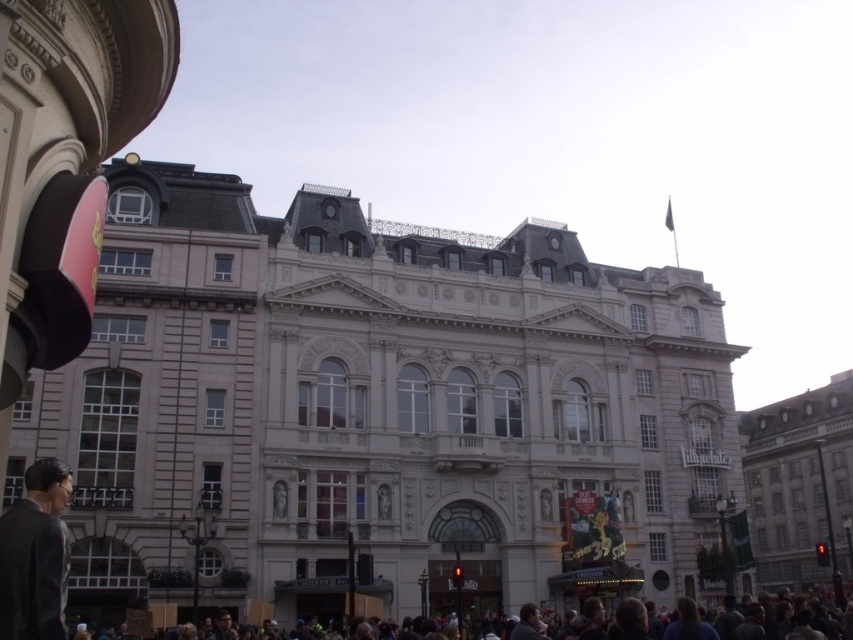
Based on the photo, can you confirm if dark gray clothing at lower center is bigger than dark gray suit at lower left?

Correct, dark gray clothing at lower center is larger in size than dark gray suit at lower left.

Which is behind, point (431, 627) or point (59, 570)?

The point (431, 627) is more distant.

Is point (793, 620) in front of point (15, 516)?

No, (793, 620) is behind (15, 516).

At what (x,y) coordinates should I click in order to perform the action: click on dark gray clothing at lower center. Please return your answer as a coordinate pair (x, y). Looking at the image, I should click on (701, 620).

Which of these two, dark gray clothing at lower center or matte black glasses at lower center, stands taller?

Standing taller between the two is dark gray clothing at lower center.

Who is positioned more to the left, dark gray clothing at lower center or matte black glasses at lower center?

From the viewer's perspective, matte black glasses at lower center appears more on the left side.

At what (x,y) coordinates should I click in order to perform the action: click on dark gray clothing at lower center. Please return your answer as a coordinate pair (x, y). Looking at the image, I should click on (701, 620).

Image resolution: width=853 pixels, height=640 pixels. Identify the location of dark gray suit at lower left. (35, 556).

Can you confirm if dark gray suit at lower left is taller than matte black glasses at lower center?

Yes.

Is point (68, 563) behind point (219, 620)?

That is False.

The width and height of the screenshot is (853, 640). What are the coordinates of `dark gray suit at lower left` in the screenshot? It's located at (x=35, y=556).